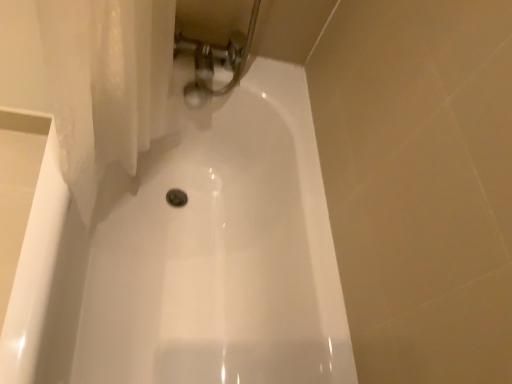
Question: From a real-world perspective, is polished chrome faucet at upper center positioned above or below white glossy bathtub at center?

Choices:
 (A) above
 (B) below

Answer: (A)

Question: Is polished chrome faucet at upper center wider or thinner than white glossy bathtub at center?

Choices:
 (A) wide
 (B) thin

Answer: (B)

Question: From the image's perspective, relative to white glossy bathtub at center, is polished chrome faucet at upper center above or below?

Choices:
 (A) above
 (B) below

Answer: (A)

Question: Does point (61, 350) appear closer or farther from the camera than point (245, 36)?

Choices:
 (A) farther
 (B) closer

Answer: (B)

Question: In terms of width, does white glossy bathtub at center look wider or thinner when compared to polished chrome faucet at upper center?

Choices:
 (A) wide
 (B) thin

Answer: (A)

Question: Considering the relative positions of white glossy bathtub at center and polished chrome faucet at upper center in the image provided, is white glossy bathtub at center to the left or to the right of polished chrome faucet at upper center?

Choices:
 (A) right
 (B) left

Answer: (B)

Question: Is white glossy bathtub at center taller or shorter than polished chrome faucet at upper center?

Choices:
 (A) tall
 (B) short

Answer: (A)